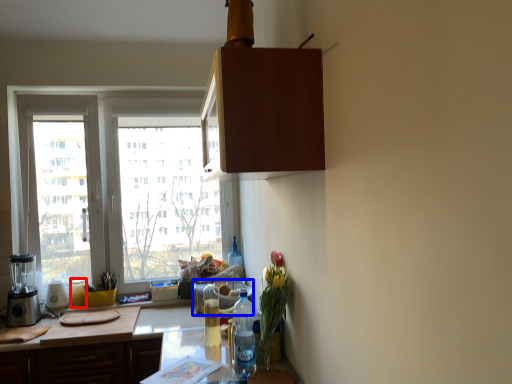
Question: Which object is further to the camera taking this photo, bottle (highlighted by a red box) or appliance (highlighted by a blue box)?

Choices:
 (A) bottle
 (B) appliance

Answer: (A)